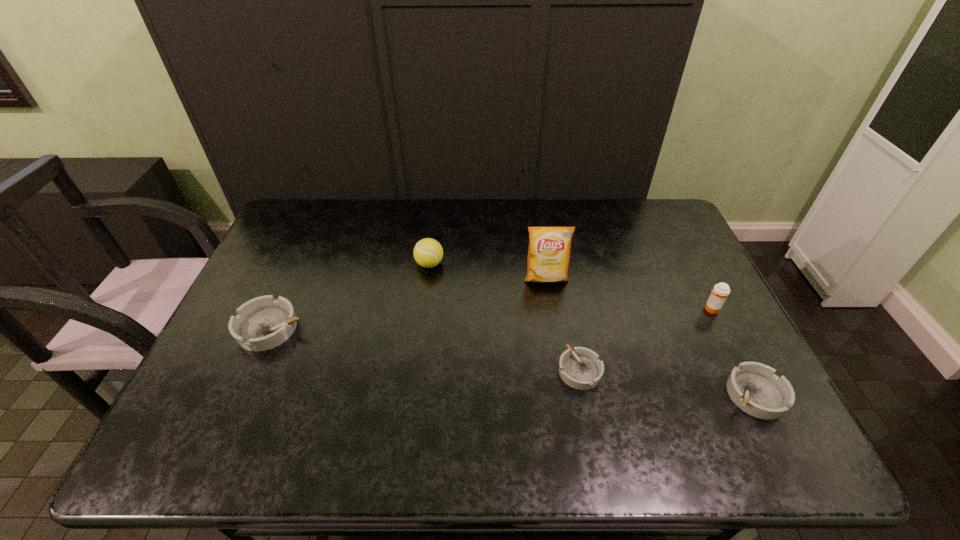
I want to click on free spot located 0.370m on the left of the shortest object, so click(411, 370).

Find the location of `free region located 0.220m on the back of the rightmost ashtray`. free region located 0.220m on the back of the rightmost ashtray is located at coordinates (710, 306).

Identify the location of vacant space located on the front-facing side of the tallest object. This screenshot has height=540, width=960. (561, 373).

Where is `free space located 0.230m on the back of the fifth object from right to left`? The height and width of the screenshot is (540, 960). free space located 0.230m on the back of the fifth object from right to left is located at coordinates (436, 213).

This screenshot has height=540, width=960. Identify the location of vacant space located on the left of the medicine. (682, 309).

This screenshot has width=960, height=540. Identify the location of object that is at the left edge. (263, 323).

This screenshot has width=960, height=540. What are the coordinates of `ashtray that is at the right edge` in the screenshot? It's located at click(x=752, y=386).

Find the location of `medicine at the right edge`. medicine at the right edge is located at coordinates (721, 290).

Where is `object positioned at the near right corner`? This screenshot has height=540, width=960. object positioned at the near right corner is located at coordinates (752, 386).

Locate an element on the screen. The height and width of the screenshot is (540, 960). free space at the far edge of the desktop is located at coordinates (341, 220).